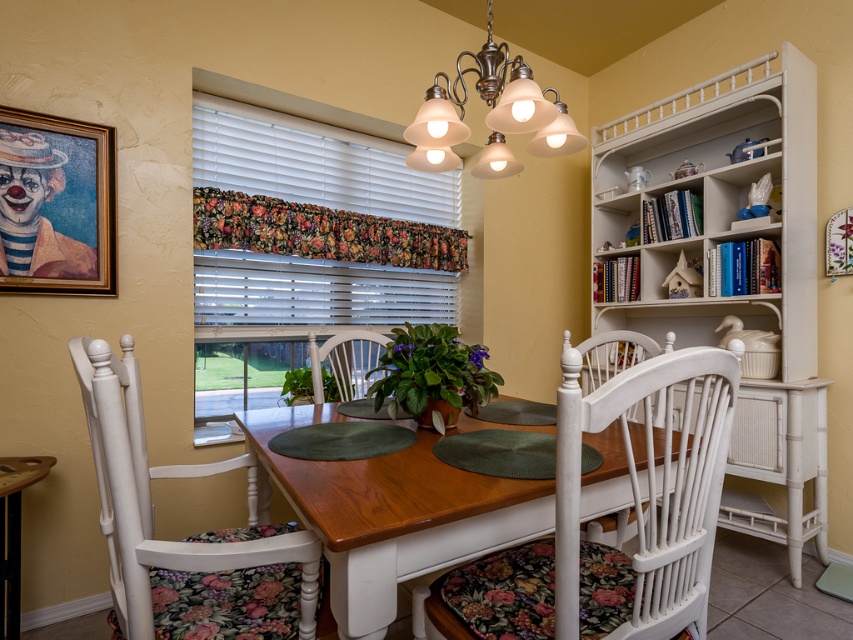
Question: Among these objects, which one is nearest to the camera?

Choices:
 (A) white blinds at upper center
 (B) white wood chair at right
 (C) white wood chair with floral cushion at center

Answer: (C)

Question: Which object appears farthest from the camera in this image?

Choices:
 (A) wooden table at lower left
 (B) white wood chair with floral cushion at lower left
 (C) white blinds at upper left

Answer: (C)

Question: Is wooden table at center smaller than white blinds at upper center?

Choices:
 (A) no
 (B) yes

Answer: (A)

Question: Is the position of white wood chair with floral cushion at center less distant than that of wooden table at lower left?

Choices:
 (A) yes
 (B) no

Answer: (A)

Question: Which object appears closest to the camera in this image?

Choices:
 (A) white wood chair with floral cushion at center
 (B) white plastic blinds at center

Answer: (A)

Question: Is white blinds at upper left positioned in front of white blinds at upper center?

Choices:
 (A) yes
 (B) no

Answer: (A)